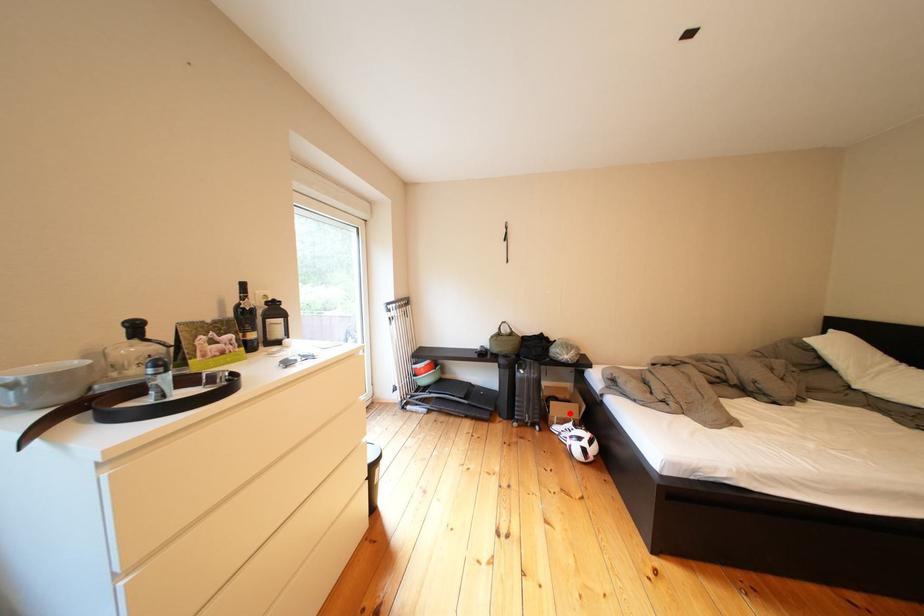
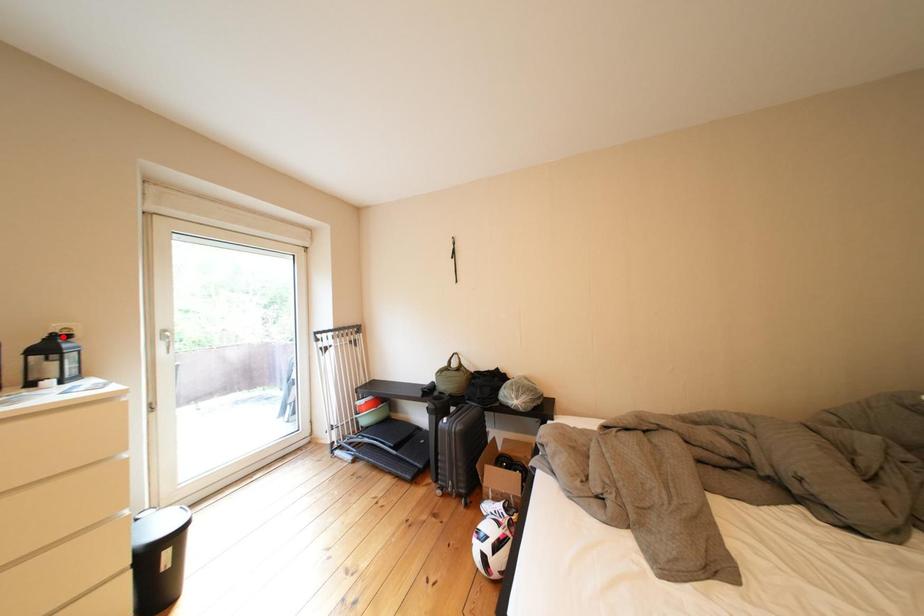
I am providing you with two images of the same scene from different viewpoints. A red point is marked on the first image and another point is marked on the second image. Are the points marked in image1 and image2 representing the same 3D position?

No